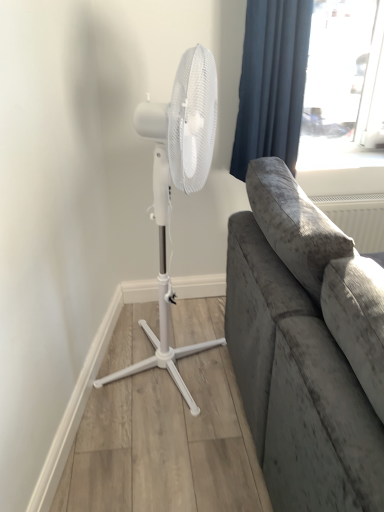
Question: Is white plastic mechanical fan at left smaller than blue velvet curtain at upper right?

Choices:
 (A) yes
 (B) no

Answer: (B)

Question: Can you confirm if white plastic mechanical fan at left is wider than blue velvet curtain at upper right?

Choices:
 (A) no
 (B) yes

Answer: (B)

Question: Considering the relative positions of white plastic mechanical fan at left and blue velvet curtain at upper right in the image provided, is white plastic mechanical fan at left to the left of blue velvet curtain at upper right from the viewer's perspective?

Choices:
 (A) yes
 (B) no

Answer: (A)

Question: Does white plastic mechanical fan at left touch blue velvet curtain at upper right?

Choices:
 (A) no
 (B) yes

Answer: (A)

Question: Is white plastic mechanical fan at left far from blue velvet curtain at upper right?

Choices:
 (A) yes
 (B) no

Answer: (B)

Question: From the image's perspective, does white plastic mechanical fan at left appear lower than blue velvet curtain at upper right?

Choices:
 (A) no
 (B) yes

Answer: (B)

Question: Considering the relative sizes of blue velvet curtain at upper right and white plastic mechanical fan at left in the image provided, is blue velvet curtain at upper right bigger than white plastic mechanical fan at left?

Choices:
 (A) yes
 (B) no

Answer: (B)

Question: From a real-world perspective, is blue velvet curtain at upper right positioned under white plastic mechanical fan at left based on gravity?

Choices:
 (A) no
 (B) yes

Answer: (A)

Question: Can you confirm if blue velvet curtain at upper right is taller than white plastic mechanical fan at left?

Choices:
 (A) yes
 (B) no

Answer: (B)

Question: Would you say blue velvet curtain at upper right contains white plastic mechanical fan at left?

Choices:
 (A) yes
 (B) no

Answer: (B)

Question: Considering the relative sizes of blue velvet curtain at upper right and white plastic mechanical fan at left in the image provided, is blue velvet curtain at upper right smaller than white plastic mechanical fan at left?

Choices:
 (A) yes
 (B) no

Answer: (A)

Question: Is the position of blue velvet curtain at upper right less distant than that of white plastic mechanical fan at left?

Choices:
 (A) no
 (B) yes

Answer: (A)

Question: Considering their positions, is white plastic mechanical fan at left located in front of or behind blue velvet curtain at upper right?

Choices:
 (A) behind
 (B) front

Answer: (B)